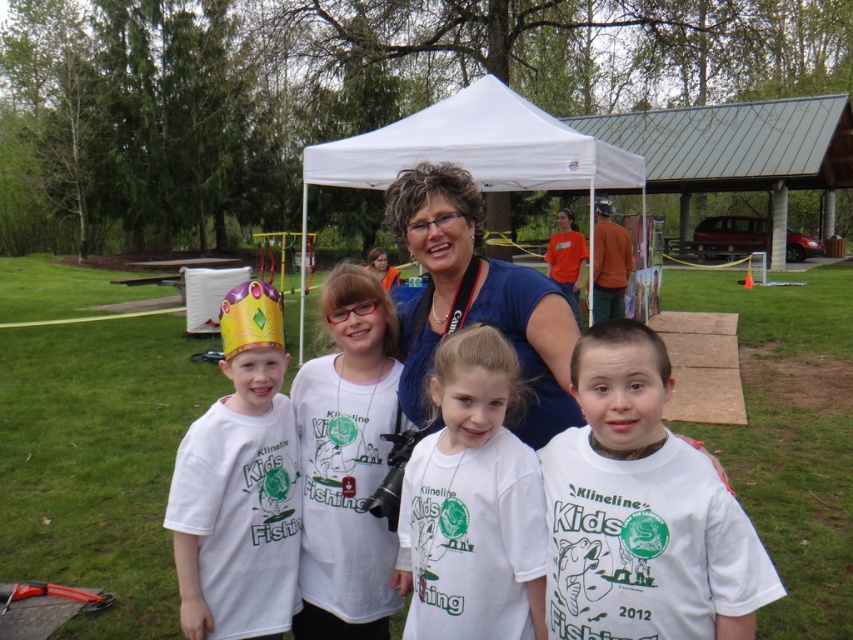
You are organizing a photo shoot and need to ensure that all items are visible in the frame. Given that the white cotton shirt at center and the white paper crown at left are both important elements, which one might require more careful positioning to avoid being obscured by other objects?

The white paper crown at left might require more careful positioning since it is smaller in size than the white cotton shirt at center and could be easily obscured by other objects in the scene.

You are standing at the position of the adult woman in the group. You want to take a photo of both the point at coordinates point (593, 472) and point (286, 605) in the image. Which point should you focus on first to ensure both are in focus?

You should focus on point (593, 472) first because it is closer to you than point (286, 605). By focusing on the closer point, the farther point will also be within the depth of field and in focus.

You are organizing a photo shoot and need to ensure that the white cotton shirt at center and the white paper crown at left are visible in the frame. Given their sizes, which object might require more space in the photo to be fully captured?

The white cotton shirt at center requires more space in the photo because its width is larger than the white paper crown at left.